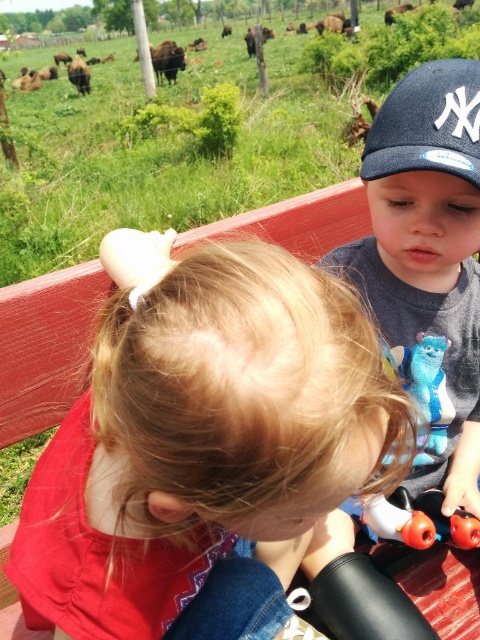
Question: Can you confirm if blonde hair at center is wider than blue plush toy at center?

Choices:
 (A) no
 (B) yes

Answer: (B)

Question: Estimate the real-world distances between objects in this image. Which object is closer to the blue plush toy at center?

Choices:
 (A) blue fabric baseball cap at upper right
 (B) dark blue cotton cap at upper right
 (C) blonde hair at center

Answer: (B)

Question: Can you confirm if blonde hair at center is positioned to the right of blue plush toy at center?

Choices:
 (A) yes
 (B) no

Answer: (B)

Question: Is dark blue cotton cap at upper right positioned behind blue fabric baseball cap at upper right?

Choices:
 (A) yes
 (B) no

Answer: (B)

Question: Which object is the closest to the blonde hair at center?

Choices:
 (A) blue fabric baseball cap at upper right
 (B) blue plush toy at center

Answer: (B)

Question: Which point appears closest to the camera in this image?

Choices:
 (A) (419, 401)
 (B) (471, 228)

Answer: (B)